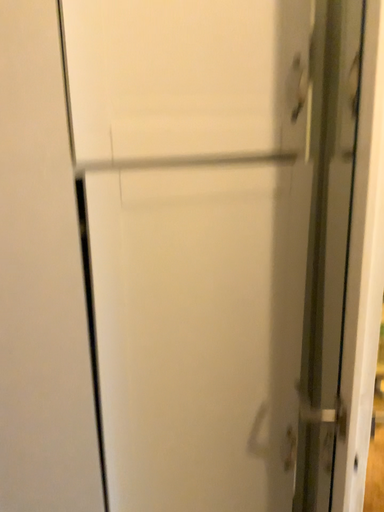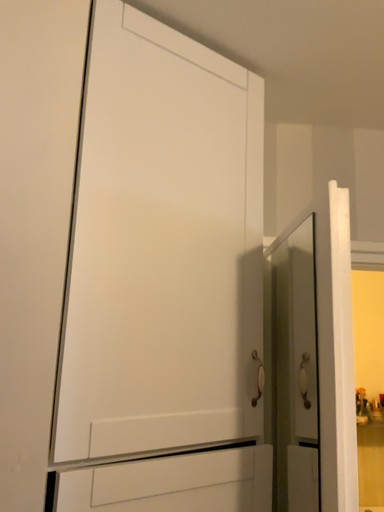
Question: Which way did the camera rotate in the video?

Choices:
 (A) rotated right
 (B) rotated left

Answer: (A)